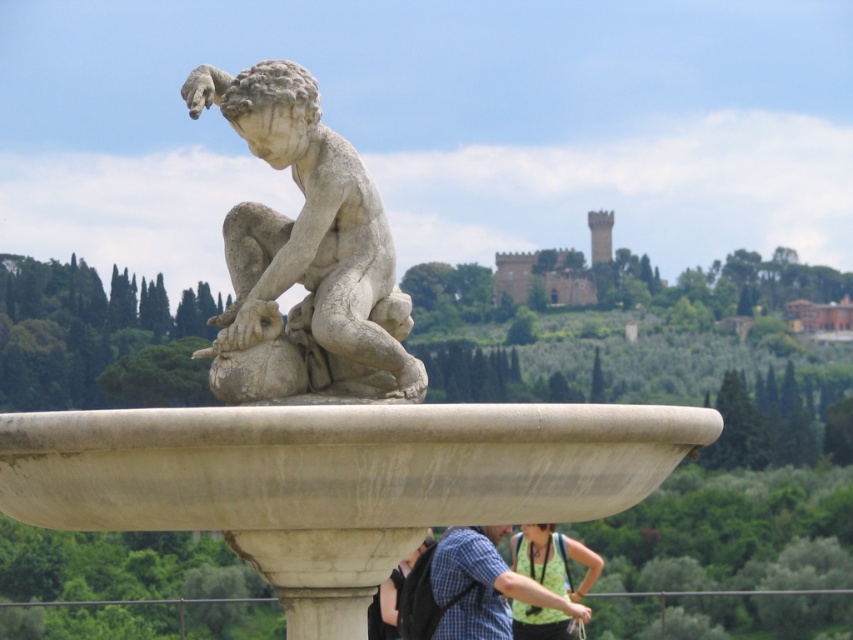
Question: Which of these objects is positioned farthest from the white marble statue at center?

Choices:
 (A) green fabric top at lower center
 (B) matte black shirt at lower center

Answer: (A)

Question: In this image, where is blue plaid shirt at center located relative to matte black shirt at lower center?

Choices:
 (A) above
 (B) below

Answer: (B)

Question: From the image, what is the correct spatial relationship of blue plaid shirt at center in relation to green fabric top at lower center?

Choices:
 (A) below
 (B) above

Answer: (B)

Question: Among these objects, which one is farthest from the camera?

Choices:
 (A) blue plaid shirt at center
 (B) matte black shirt at lower center
 (C) white marble statue at center

Answer: (A)

Question: Which object is the closest to the white marble statue at center?

Choices:
 (A) green fabric top at lower center
 (B) matte black shirt at lower center

Answer: (B)

Question: Can you confirm if white marble statue at center is smaller than matte black shirt at lower center?

Choices:
 (A) no
 (B) yes

Answer: (B)